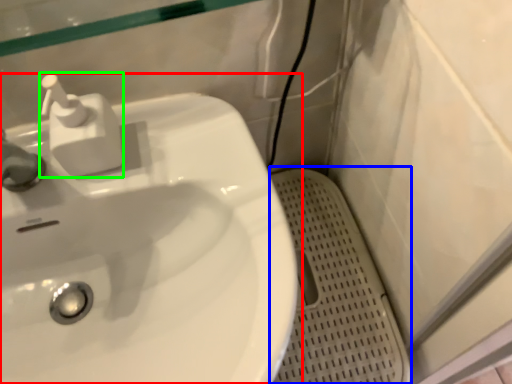
Question: Estimate the real-world distances between objects in this image. Which object is farther from sink (highlighted by a red box), porcelain (highlighted by a blue box) or soap dispenser (highlighted by a green box)?

Choices:
 (A) porcelain
 (B) soap dispenser

Answer: (A)